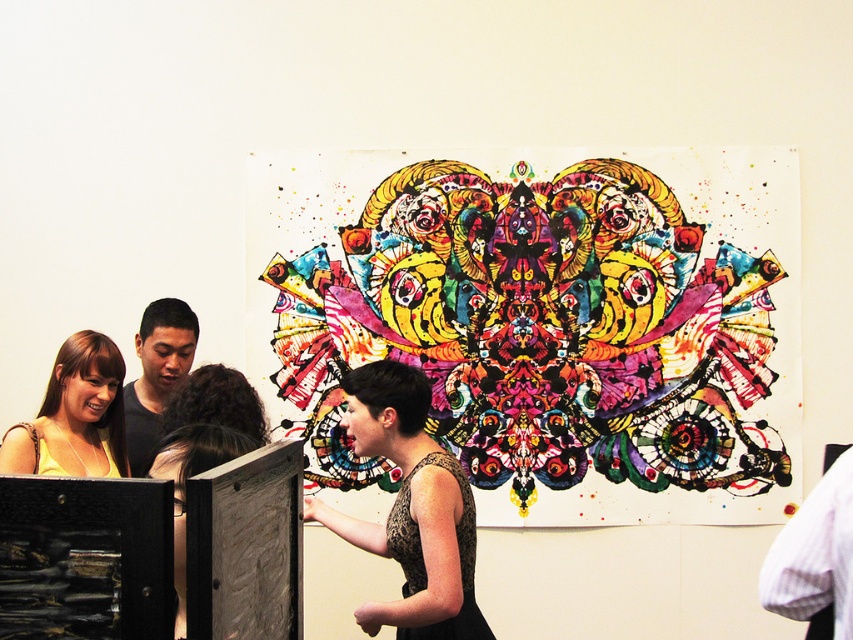
Question: Which point is closer to the camera?

Choices:
 (A) (171, 352)
 (B) (389, 518)
 (C) (90, 368)
 (D) (682, 337)

Answer: (B)

Question: Does vibrant painted artwork at center appear over matte black shirt at left?

Choices:
 (A) yes
 (B) no

Answer: (A)

Question: Which object is closer to the camera taking this photo?

Choices:
 (A) matte black shirt at left
 (B) matte yellow dress at lower left
 (C) white striped shirt at right

Answer: (C)

Question: Is vibrant painted artwork at center above matte black shirt at left?

Choices:
 (A) no
 (B) yes

Answer: (B)

Question: Can you confirm if matte yellow dress at lower left is positioned to the left of white striped shirt at right?

Choices:
 (A) no
 (B) yes

Answer: (B)

Question: Among these objects, which one is farthest from the camera?

Choices:
 (A) black textured dress at center
 (B) vibrant painted artwork at center
 (C) white striped shirt at right
 (D) matte black shirt at left

Answer: (B)